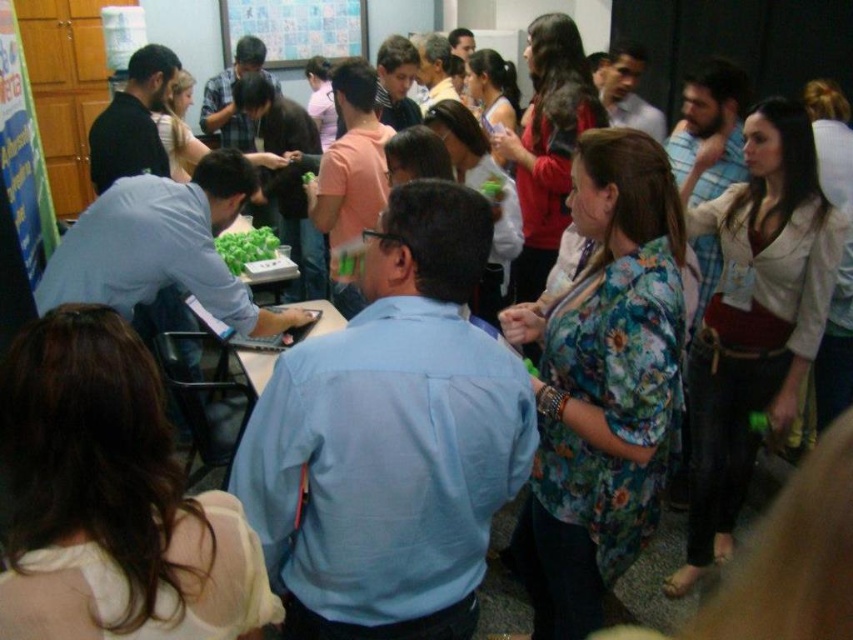
You are organizing a presentation and need to place a projector screen to the right of the green leafy vegetables at center. Can the white paperboard at upper center be moved to make space for the projector screen?

The white paperboard at upper center is positioned on the left side of green leafy vegetables at center, so moving it to the right would require placing it where the projector screen is intended to go. This means the white paperboard at upper center must be moved to another location to make space for the projector screen.

In the scene of the indoor gathering, there is a floral fabric blouse at right and green leafy vegetables at center. Based on their positions, which object is located more to the right side of the image?

The floral fabric blouse at right is located more to the right side of the image compared to the green leafy vegetables at center, as it is positioned to the right of them.

You are a photographer at the event and want to capture a clear photo of the white paperboard at upper center. However, there is someone wearing a floral fabric blouse at right blocking the view. Can you adjust your position to avoid the obstruction?

The floral fabric blouse at right is in front of the white paperboard at upper center, so moving to the left side would allow you to capture the white paperboard at upper center without the obstruction.